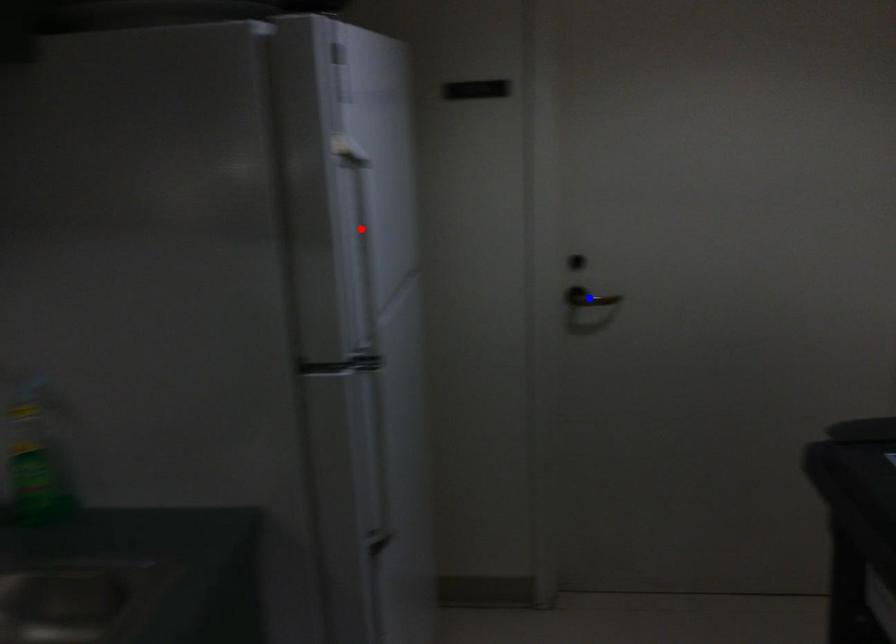
Question: Two points are marked on the image. Which point is closer to the camera?

Choices:
 (A) Blue point is closer.
 (B) Red point is closer.

Answer: (B)